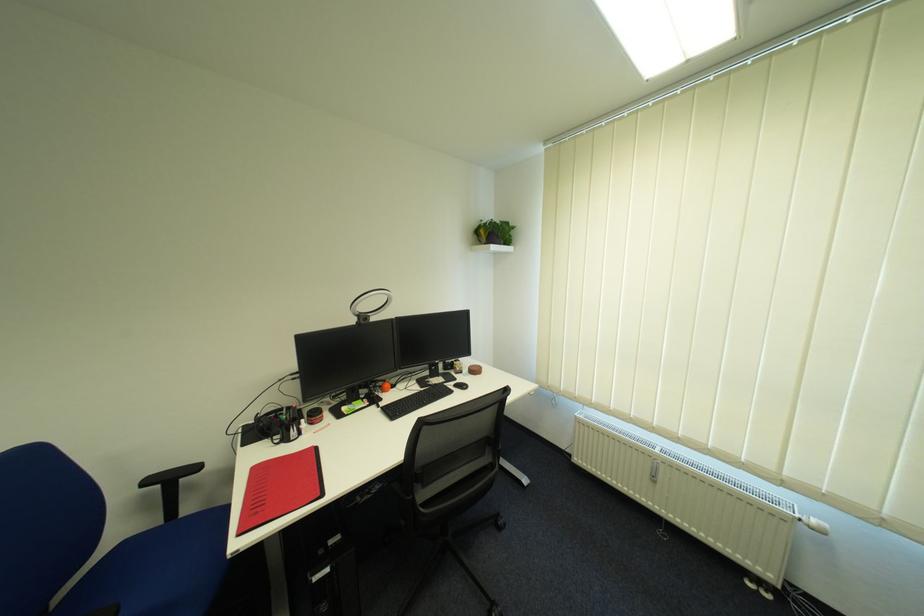
Locate an element on the screen. The image size is (924, 616). potted plant is located at coordinates (493, 232).